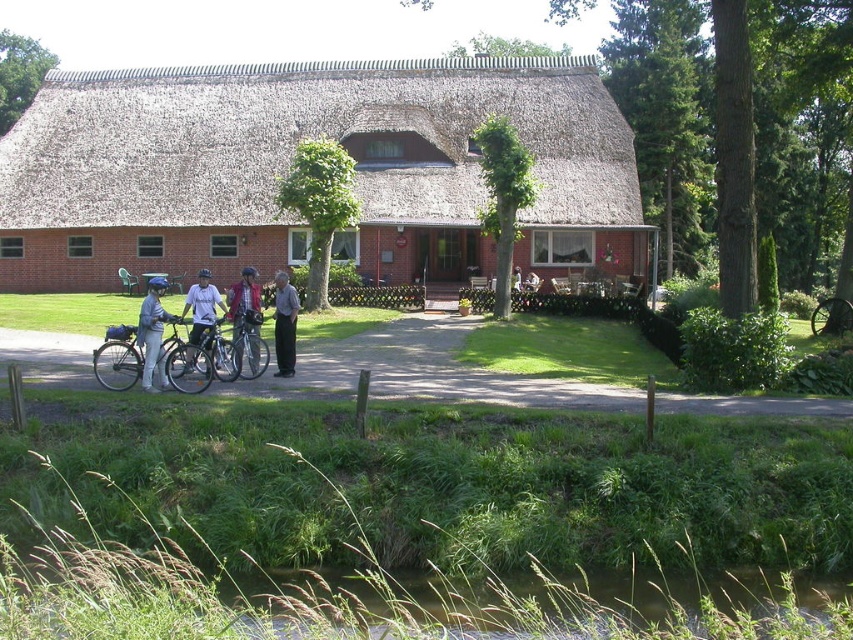
Does matte black bicycle at lower left have a greater width compared to matte red jacket at center?

No, matte black bicycle at lower left is not wider than matte red jacket at center.

Is point (120, 342) closer to viewer compared to point (234, 310)?

Yes, it is.

This screenshot has height=640, width=853. I want to click on matte black bicycle at lower left, so click(119, 358).

Is thatched roof cottage at center to the right of matte blue helmet at left from the viewer's perspective?

Indeed, thatched roof cottage at center is positioned on the right side of matte blue helmet at left.

Is thatched roof cottage at center further to the viewer compared to matte blue helmet at left?

That is True.

The width and height of the screenshot is (853, 640). Describe the element at coordinates (289, 163) in the screenshot. I see `thatched roof cottage at center` at that location.

You are a GUI agent. You are given a task and a screenshot of the screen. Output one action in this format:
    pyautogui.click(x=<x>, y=<y>)
    Task: Click on the thatched roof cottage at center
    
    Given the screenshot: What is the action you would take?
    pyautogui.click(x=289, y=163)

Does matte black bicycle at lower left have a greater width compared to matte black bicycle at center?

Incorrect, matte black bicycle at lower left's width does not surpass matte black bicycle at center's.

Who is more forward, (97, 376) or (247, 305)?

Positioned in front is point (97, 376).

What are the coordinates of `matte black bicycle at lower left` in the screenshot? It's located at (119, 358).